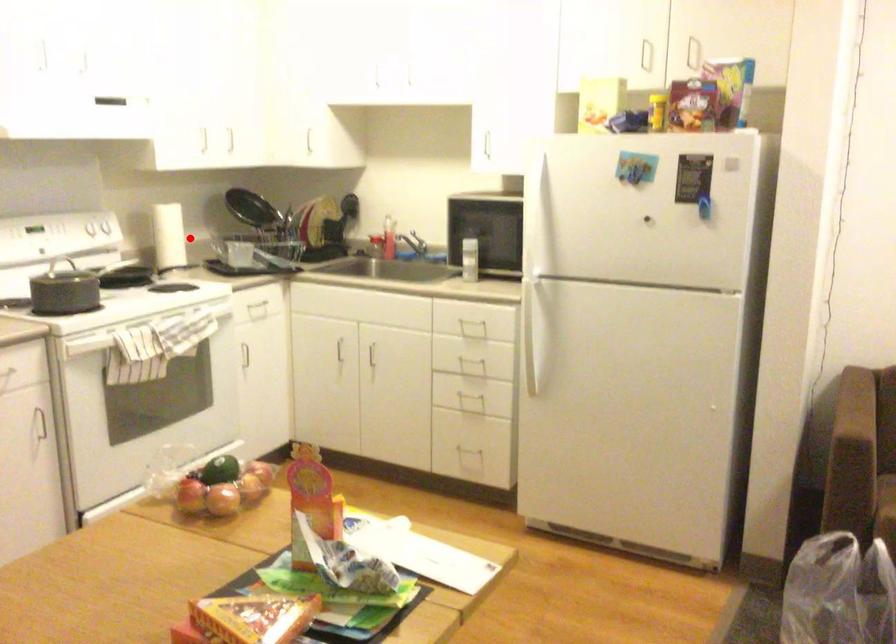
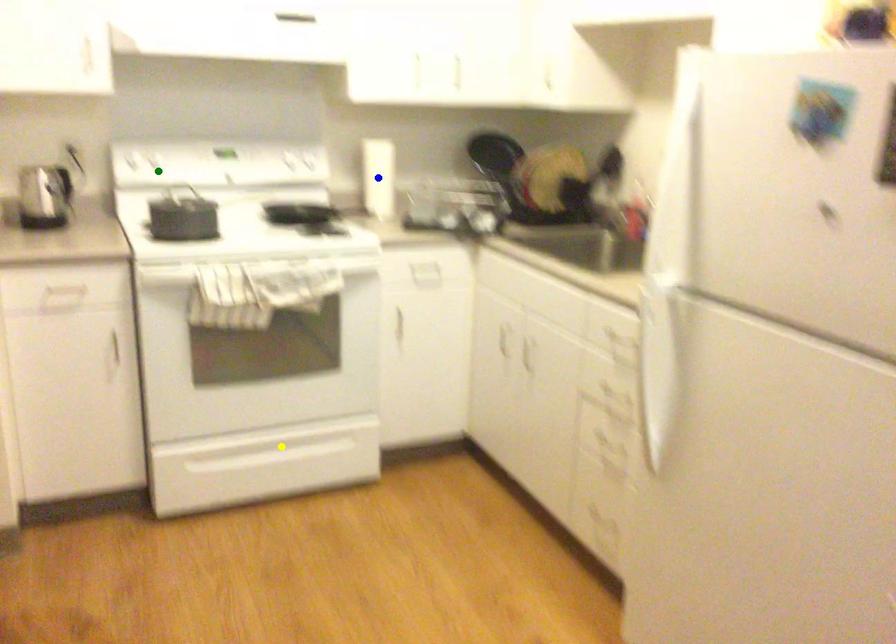
Question: I am providing you with two images of the same scene from different viewpoints. A red point is marked on the first image. You are given multiple points on the second image. Which mark in image 2 goes with the point in image 1?

Choices:
 (A) blue point
 (B) green point
 (C) yellow point

Answer: (A)